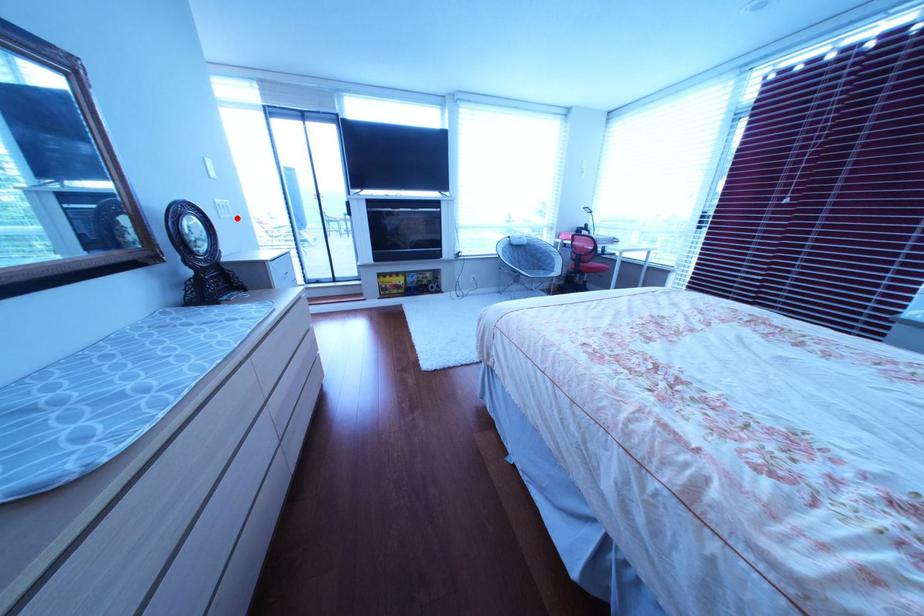
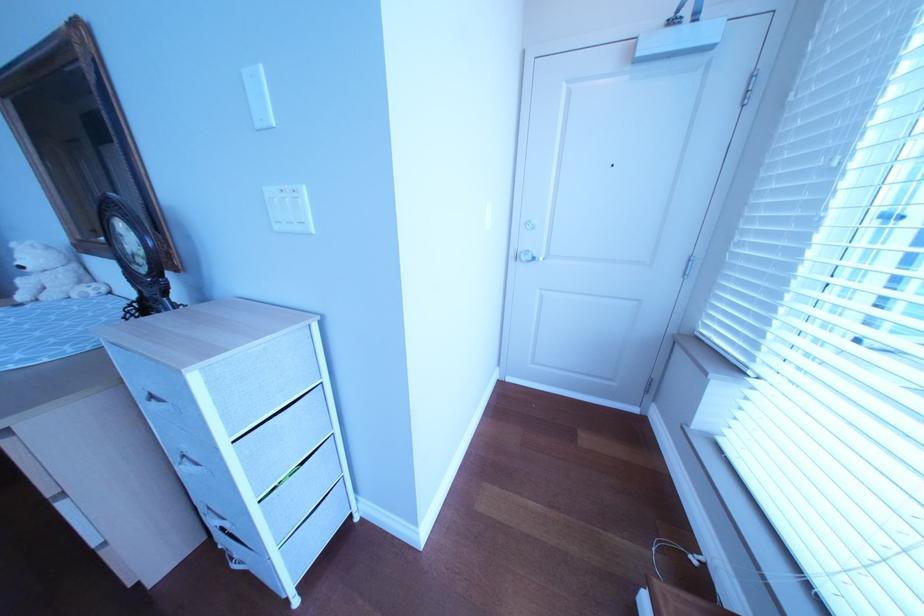
In the second image, find the point that corresponds to the highlighted location in the first image.

(292, 229)